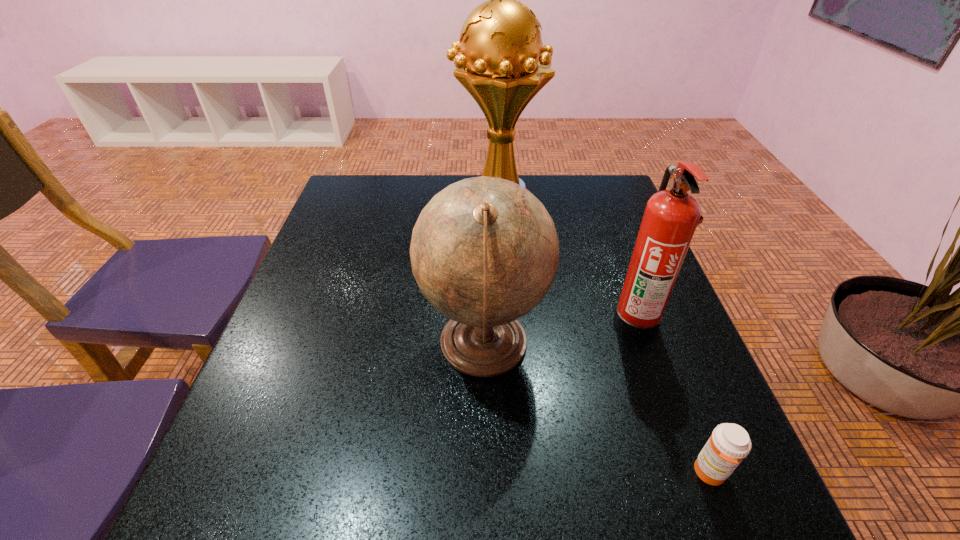
Find the location of a particular element. free space located with the nozzle pointing from the back of the fire extinguisher is located at coordinates (534, 322).

Locate an element on the screen. This screenshot has height=540, width=960. vacant region located with the nozzle pointing from the back of the fire extinguisher is located at coordinates (571, 322).

At what (x,y) coordinates should I click in order to perform the action: click on free location located 0.110m on the front-facing side of the globe. Please return your answer as a coordinate pair (x, y). Image resolution: width=960 pixels, height=540 pixels. Looking at the image, I should click on (368, 346).

Where is `free spot located 0.150m on the front-facing side of the globe`? The image size is (960, 540). free spot located 0.150m on the front-facing side of the globe is located at coordinates (348, 346).

Find the location of a particular element. The width and height of the screenshot is (960, 540). vacant space positioned 0.240m on the front-facing side of the globe is located at coordinates (304, 346).

Where is `free space located 0.310m on the back of the nearest object`? This screenshot has width=960, height=540. free space located 0.310m on the back of the nearest object is located at coordinates (650, 318).

What are the coordinates of `object situated at the far edge` in the screenshot? It's located at (503, 64).

Identify the location of object situated at the near edge. The height and width of the screenshot is (540, 960). (729, 444).

The height and width of the screenshot is (540, 960). Find the location of `fire extinguisher at the right edge`. fire extinguisher at the right edge is located at coordinates (670, 219).

Find the location of a particular element. This screenshot has width=960, height=540. medicine present at the right edge is located at coordinates (729, 444).